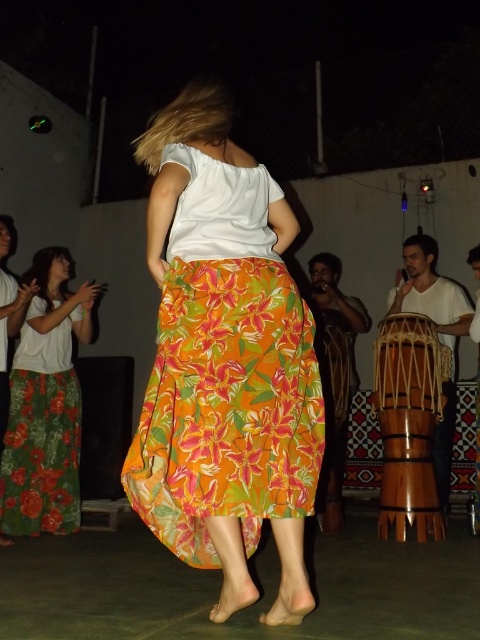
You are standing at the entrance of the event venue and want to find the floral cotton skirt at center. According to the image, where should you look to locate it?

The floral cotton skirt at center is located at the coordinates point (226,371) in the image.